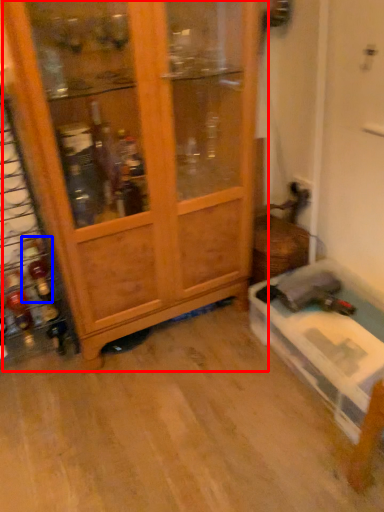
Question: Among these objects, which one is nearest to the camera, cupboard (highlighted by a red box) or bottle (highlighted by a blue box)?

Choices:
 (A) cupboard
 (B) bottle

Answer: (A)